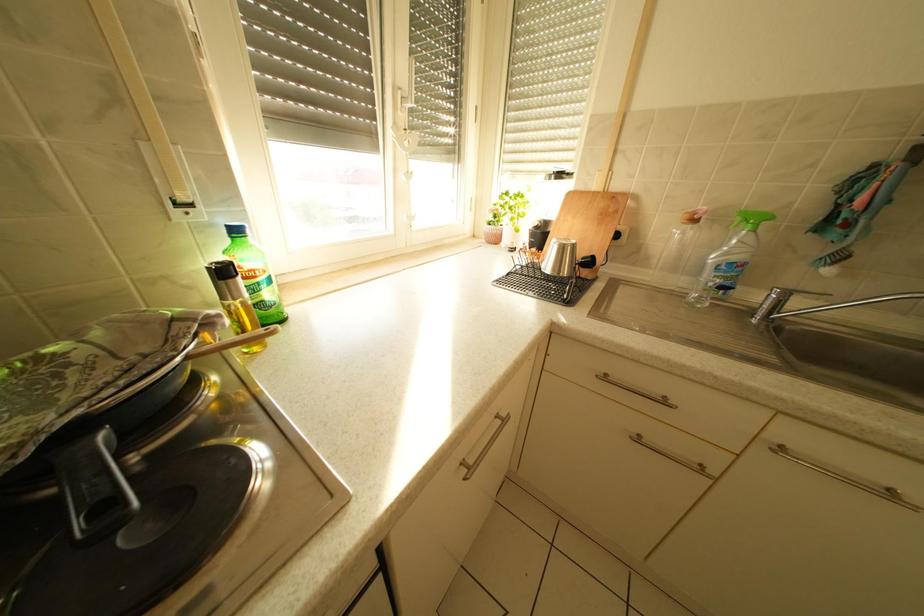
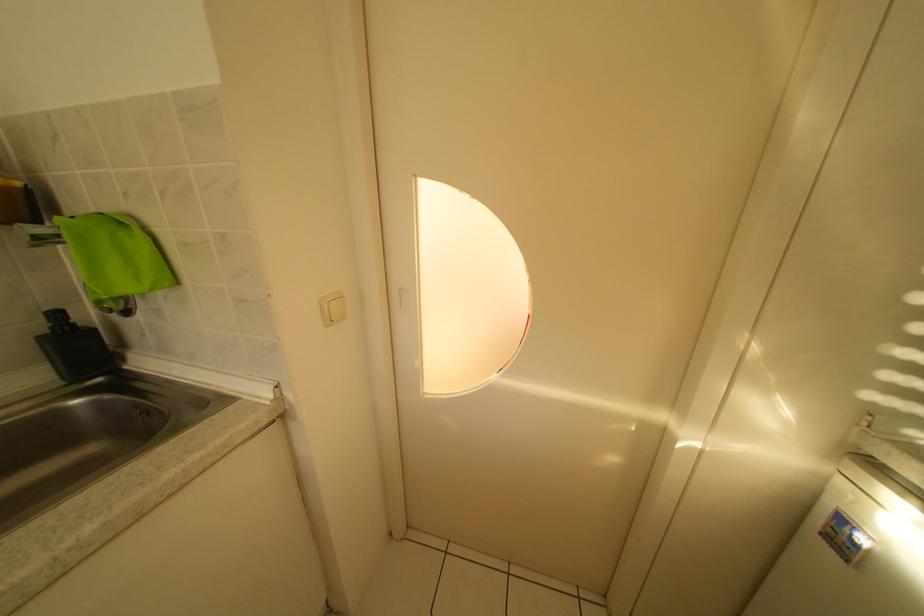
Based on the continuous images, in which direction is the camera rotating?

The rotation direction of the camera is right-down.